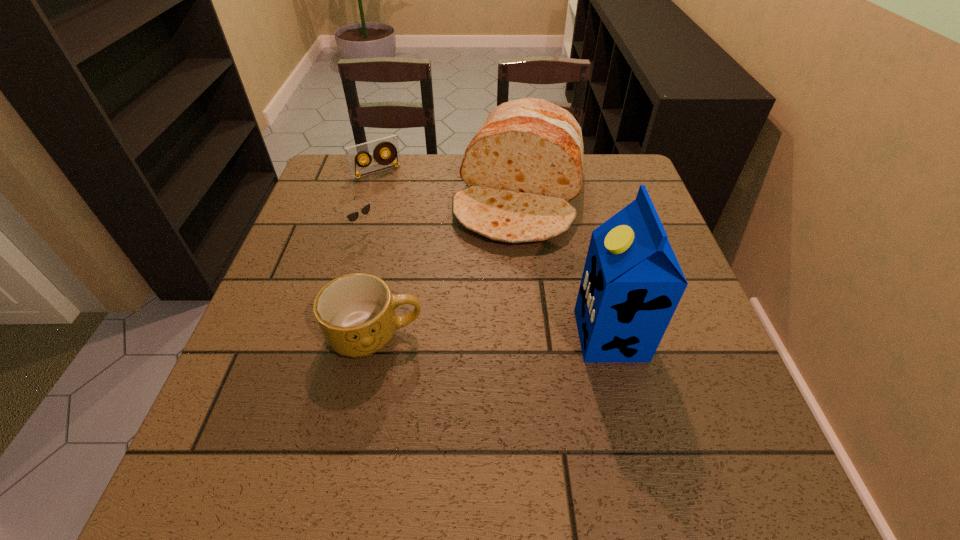
At what (x,y) coordinates should I click in order to perform the action: click on vacant spot on the desktop that is between the mug and the carton and is positioned at the front of the videotape with visible reels. Please return your answer as a coordinate pair (x, y). Image resolution: width=960 pixels, height=540 pixels. Looking at the image, I should click on (500, 335).

Where is `vacant space on the desktop that is between the mug and the tallest object and is positioned in front of the lenses of the sunglasses`? This screenshot has height=540, width=960. vacant space on the desktop that is between the mug and the tallest object and is positioned in front of the lenses of the sunglasses is located at coordinates (505, 335).

I want to click on vacant space on the desktop that is between the mug and the tallest object and is positioned at the sliced end of the bread, so click(478, 335).